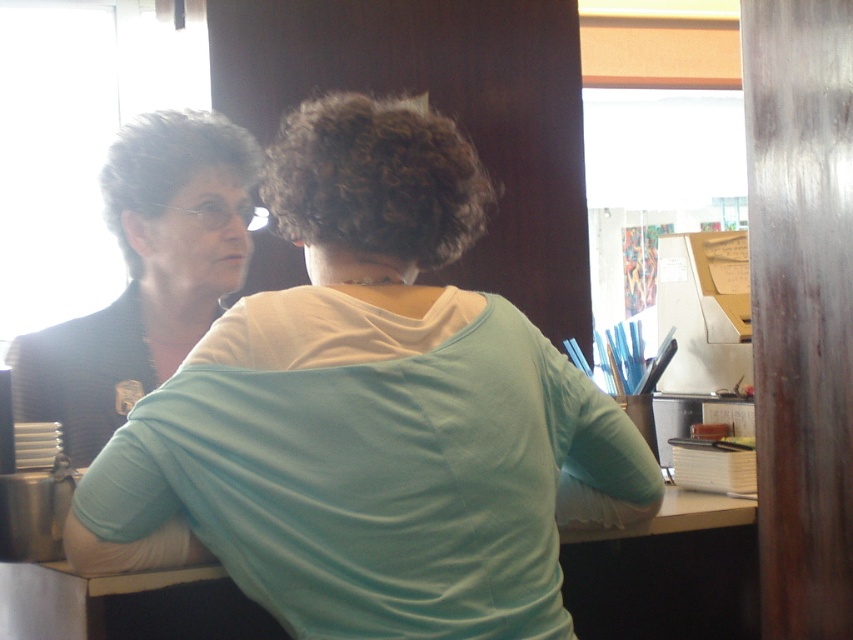
Which is more to the right, matte white shirt at upper left or matte black jacket at left?

From the viewer's perspective, matte white shirt at upper left appears more on the right side.

Based on the photo, can you confirm if matte white shirt at upper left is positioned above matte black jacket at left?

No, matte white shirt at upper left is not above matte black jacket at left.

Between point (485, 378) and point (234, 288), which one is positioned in front?

Positioned in front is point (485, 378).

Identify the location of matte white shirt at upper left. The image size is (853, 640). (370, 412).